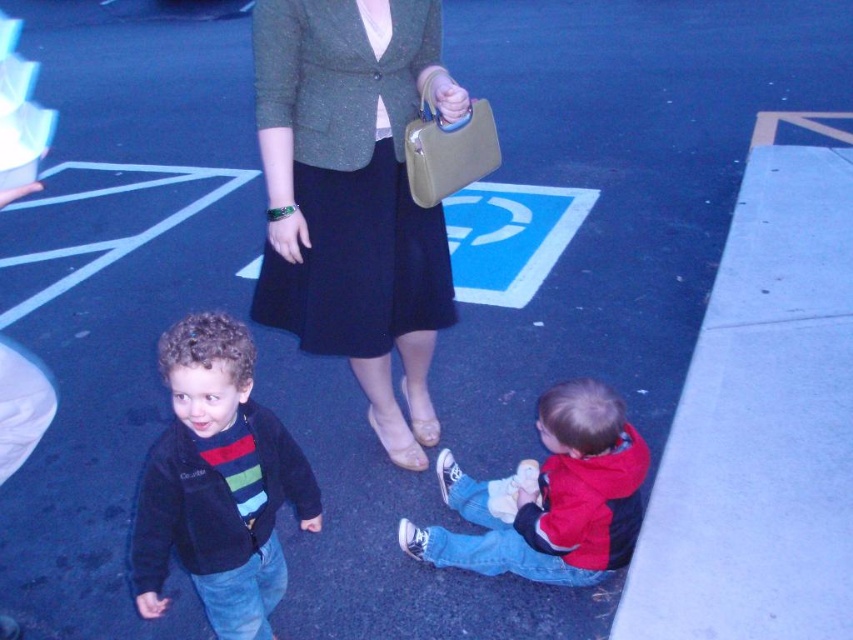
Question: Among these points, which one is nearest to the camera?

Choices:
 (A) (334, 260)
 (B) (613, 458)
 (C) (155, 449)

Answer: (C)

Question: Among these objects, which one is farthest from the camera?

Choices:
 (A) red fleece jacket at lower right
 (B) green textured blazer at center

Answer: (B)

Question: Is green textured blazer at center below red fleece jacket at lower right?

Choices:
 (A) no
 (B) yes

Answer: (A)

Question: Is green textured blazer at center closer to the viewer compared to red fleece jacket at lower right?

Choices:
 (A) no
 (B) yes

Answer: (A)

Question: Which point is farther from the camera taking this photo?

Choices:
 (A) (265, 609)
 (B) (416, 298)
 (C) (492, 524)

Answer: (B)

Question: Is green textured blazer at center behind dark blue fleece jacket at center?

Choices:
 (A) yes
 (B) no

Answer: (A)